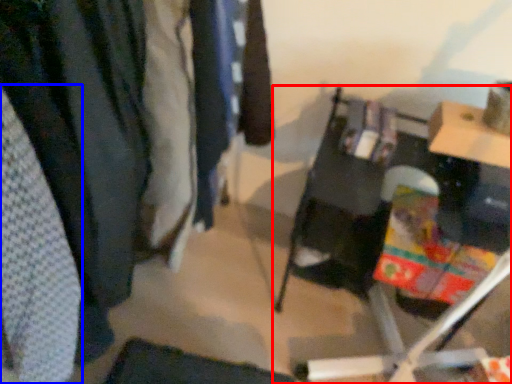
Question: Which object is closer to the camera taking this photo, furniture (highlighted by a red box) or clothing (highlighted by a blue box)?

Choices:
 (A) furniture
 (B) clothing

Answer: (B)